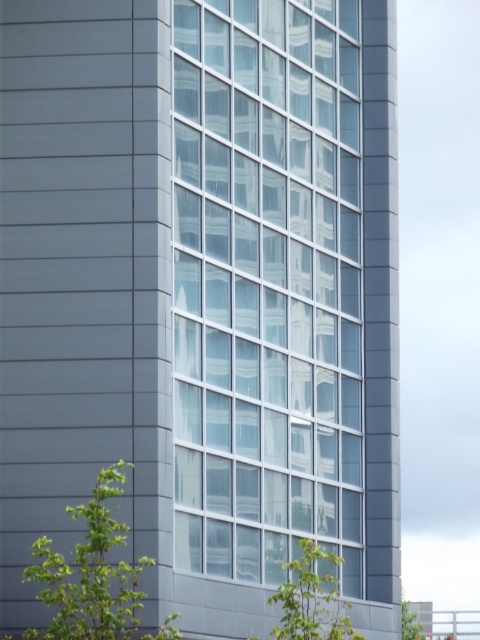
Does green leafy tree at lower left appear over green leafy tree at lower right?

Yes.

Who is more distant from viewer, (x=98, y=580) or (x=416, y=612)?

Positioned behind is point (x=416, y=612).

Where is `green leafy tree at lower left`? Image resolution: width=480 pixels, height=640 pixels. green leafy tree at lower left is located at coordinates (94, 576).

Does green leafy tree at lower left have a larger size compared to green leafy tree at lower center?

No.

Is point (132, 564) closer to viewer compared to point (350, 630)?

No.

Image resolution: width=480 pixels, height=640 pixels. I want to click on green leafy tree at lower left, so click(94, 576).

Between point (331, 580) and point (410, 632), which one is positioned behind?

Positioned behind is point (410, 632).

Measure the distance between point (334, 620) and camera.

They are 178.30 feet apart.

Locate an element on the screen. The height and width of the screenshot is (640, 480). green leafy tree at lower center is located at coordinates click(x=312, y=596).

The image size is (480, 640). Identify the location of green leafy tree at lower center. (312, 596).